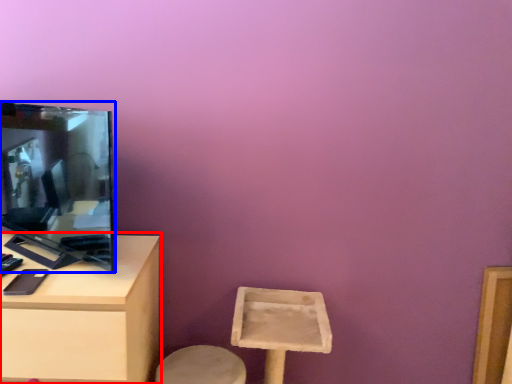
Question: Among these objects, which one is farthest to the camera, table (highlighted by a red box) or television (highlighted by a blue box)?

Choices:
 (A) table
 (B) television

Answer: (A)